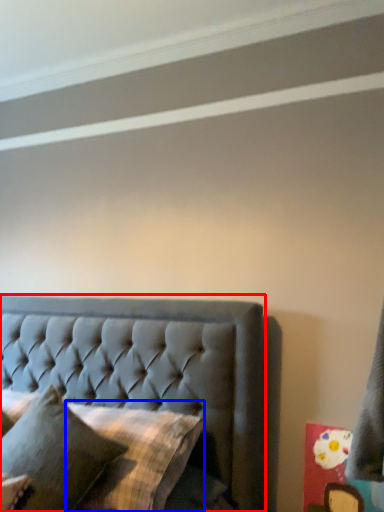
Question: Among these objects, which one is farthest to the camera, bed (highlighted by a red box) or pillow (highlighted by a blue box)?

Choices:
 (A) bed
 (B) pillow

Answer: (B)